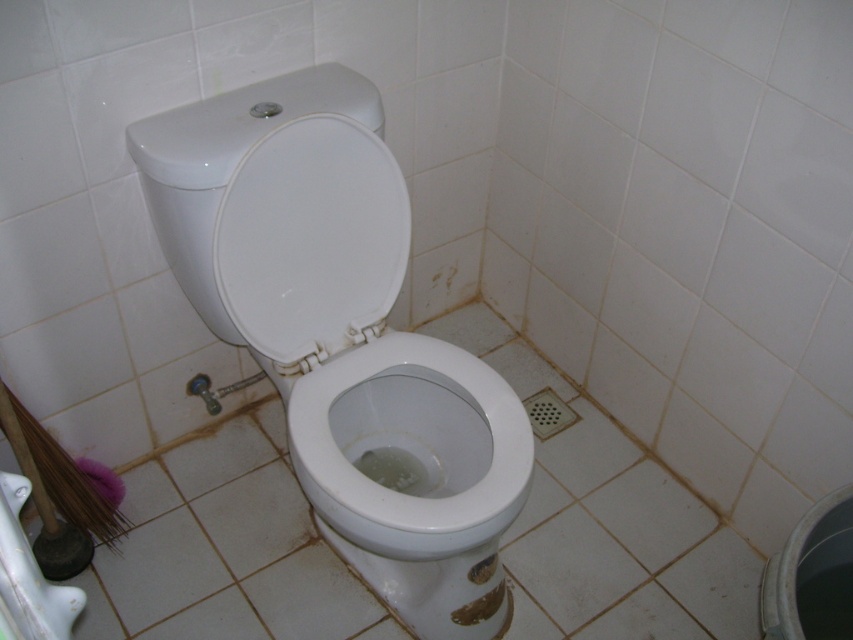
You are a plumber inspecting the bathroom. You see the white glossy toilet bowl at center and the white glossy toilet lid at center. Which one is positioned more to the right side?

The white glossy toilet bowl at center is positioned to the right of the white glossy toilet lid at center, so it is more to the right side.